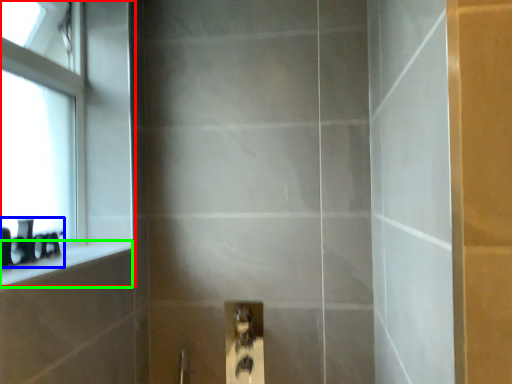
Question: Estimate the real-world distances between objects in this image. Which object is farther from window (highlighted by a red box), toiletry (highlighted by a blue box) or ledge (highlighted by a green box)?

Choices:
 (A) toiletry
 (B) ledge

Answer: (A)